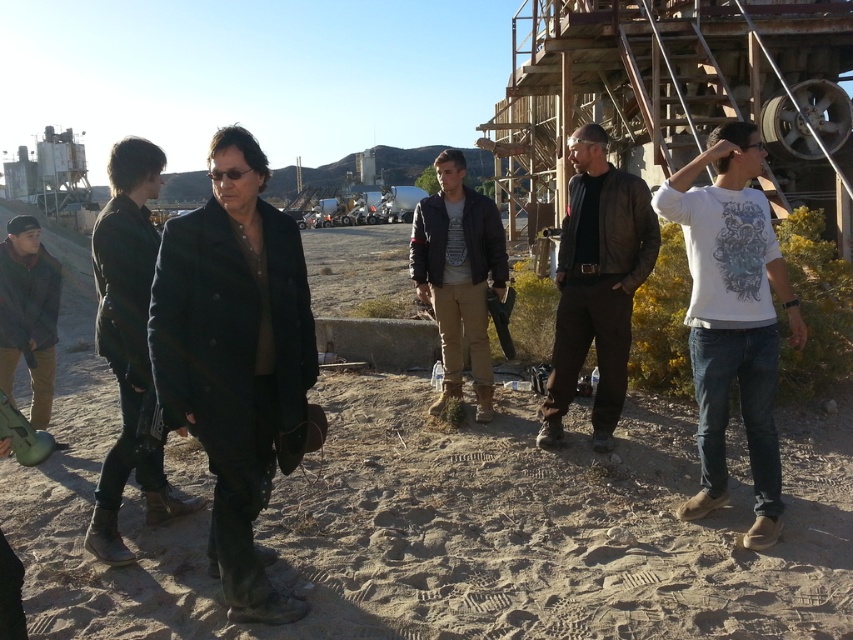
Question: Which point is closer to the camera?

Choices:
 (A) brown leather jacket at center
 (B) dirt field at center
 (C) dark brown leather jacket at lower left
 (D) leather jacket at center

Answer: (B)

Question: Does leather jacket at center appear over dark brown leather jacket at lower left?

Choices:
 (A) no
 (B) yes

Answer: (B)

Question: Among these points, which one is nearest to the camera?

Choices:
 (A) (764, 296)
 (B) (33, 240)

Answer: (A)

Question: Can you confirm if white cotton t-shirt at right is thinner than brown leather jacket at center?

Choices:
 (A) yes
 (B) no

Answer: (B)

Question: Which object is the closest to the white cotton t-shirt at right?

Choices:
 (A) leather jacket at center
 (B) dark denim jacket at center

Answer: (A)

Question: Can you confirm if white cotton t-shirt at right is thinner than dark brown leather jacket at lower left?

Choices:
 (A) yes
 (B) no

Answer: (B)